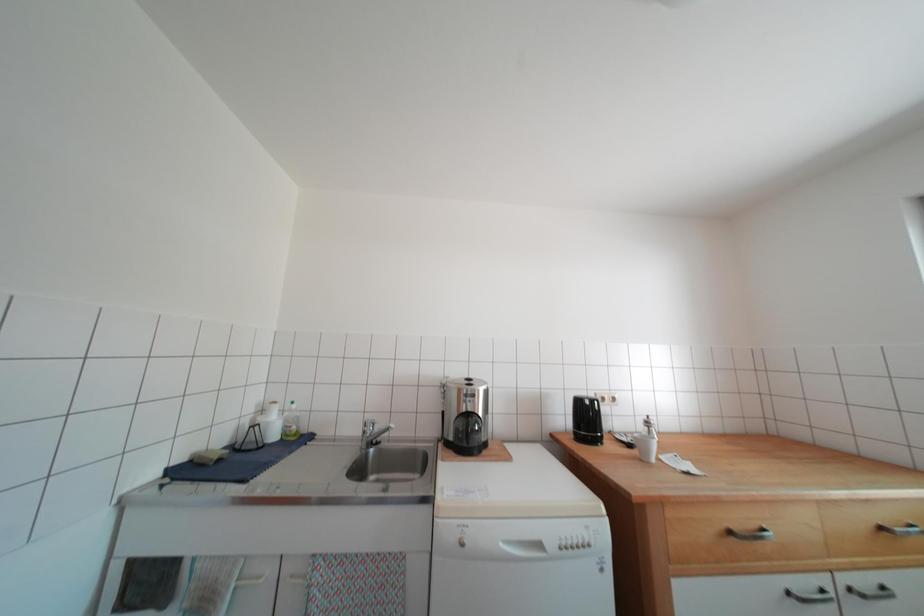
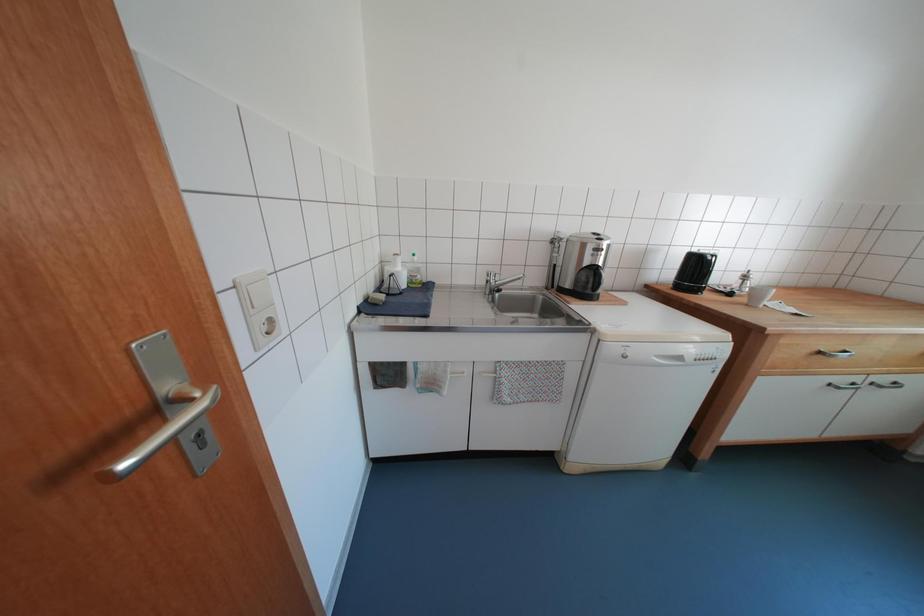
Question: How did the camera likely rotate?

Choices:
 (A) Left
 (B) Right
 (C) Up
 (D) Down

Answer: (D)